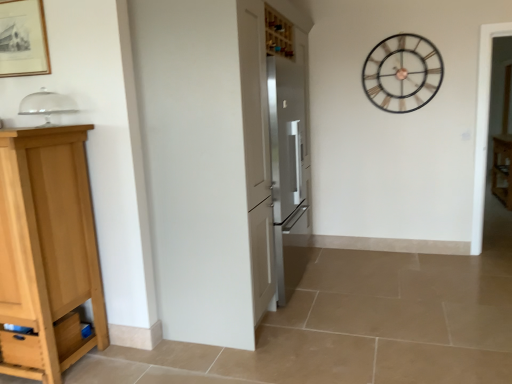
Find the location of a particular element. The image size is (512, 384). free space above metallic gold clock at upper right (from a real-world perspective) is located at coordinates (401, 29).